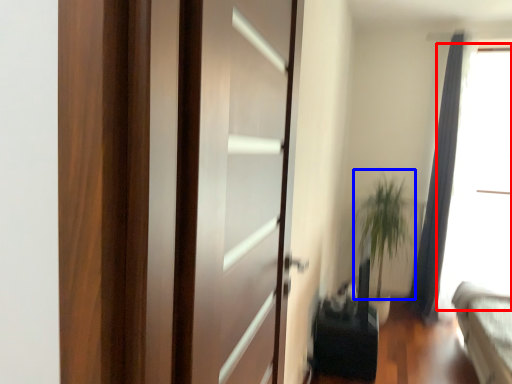
Question: Which point is further to the camera, window screen (highlighted by a red box) or plant (highlighted by a blue box)?

Choices:
 (A) window screen
 (B) plant

Answer: (B)